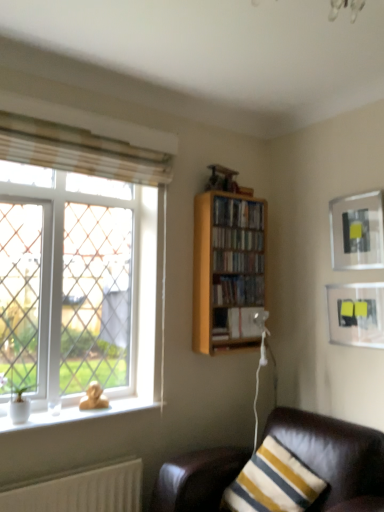
Question: Would you say wooden bookshelf at center, which is the fourth book in bottom-to-top order, contains white glass window at left?

Choices:
 (A) no
 (B) yes

Answer: (A)

Question: Is wooden bookshelf at center, the second book when ordered from top to bottom, outside white glass window at left?

Choices:
 (A) yes
 (B) no

Answer: (A)

Question: From the image's perspective, is wooden bookshelf at center, which is the fourth book in bottom-to-top order, over white glass window at left?

Choices:
 (A) yes
 (B) no

Answer: (A)

Question: Does wooden bookshelf at center, which is the fourth book in bottom-to-top order, have a greater height compared to white glass window at left?

Choices:
 (A) yes
 (B) no

Answer: (B)

Question: Does wooden bookshelf at center, the second book when ordered from top to bottom, have a larger size compared to white glass window at left?

Choices:
 (A) no
 (B) yes

Answer: (A)

Question: Considering the positions of wooden bookshelf at upper right, marked as the first book in a top-to-bottom arrangement, and white glass window at left in the image, is wooden bookshelf at upper right, marked as the first book in a top-to-bottom arrangement, wider or thinner than white glass window at left?

Choices:
 (A) wide
 (B) thin

Answer: (B)

Question: Relative to white glass window at left, is wooden bookshelf at upper right, marked as the first book in a top-to-bottom arrangement, in front or behind?

Choices:
 (A) behind
 (B) front

Answer: (A)

Question: Is wooden bookshelf at upper right, marked as the first book in a top-to-bottom arrangement, to the left or to the right of white glass window at left in the image?

Choices:
 (A) left
 (B) right

Answer: (B)

Question: Is wooden bookshelf at upper right, marked as the first book in a top-to-bottom arrangement, bigger or smaller than white glass window at left?

Choices:
 (A) big
 (B) small

Answer: (B)

Question: Is point (243, 308) positioned closer to the camera than point (74, 130)?

Choices:
 (A) closer
 (B) farther

Answer: (B)

Question: Considering their positions, is hardcover book at center, the fifth book viewed from the top, located in front of or behind beige fabric curtain at upper left?

Choices:
 (A) behind
 (B) front

Answer: (A)

Question: From a real-world perspective, is hardcover book at center, the fifth book viewed from the top, positioned above or below beige fabric curtain at upper left?

Choices:
 (A) below
 (B) above

Answer: (A)

Question: Is hardcover book at center, arranged as the 1th book when ordered from the bottom, to the left or to the right of beige fabric curtain at upper left in the image?

Choices:
 (A) left
 (B) right

Answer: (B)

Question: Is hardcover book at center, the fifth book viewed from the top, bigger or smaller than wooden bookcase at upper right?

Choices:
 (A) small
 (B) big

Answer: (A)

Question: Is hardcover book at center, the fifth book viewed from the top, spatially inside wooden bookcase at upper right, or outside of it?

Choices:
 (A) inside
 (B) outside

Answer: (A)